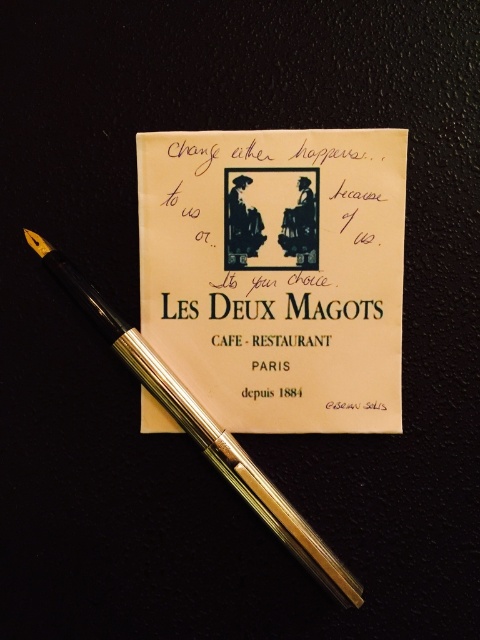
Question: Which object appears closest to the camera in this image?

Choices:
 (A) gold polished fountain pen at center
 (B) white paper sign at center

Answer: (A)

Question: Is white paper sign at center closer to camera compared to gold polished fountain pen at center?

Choices:
 (A) yes
 (B) no

Answer: (B)

Question: Is white paper sign at center below gold polished fountain pen at center?

Choices:
 (A) yes
 (B) no

Answer: (B)

Question: Which point is farther to the camera?

Choices:
 (A) white paper sign at center
 (B) gold polished fountain pen at center

Answer: (A)

Question: Is white paper sign at center to the right of gold polished fountain pen at center from the viewer's perspective?

Choices:
 (A) yes
 (B) no

Answer: (A)